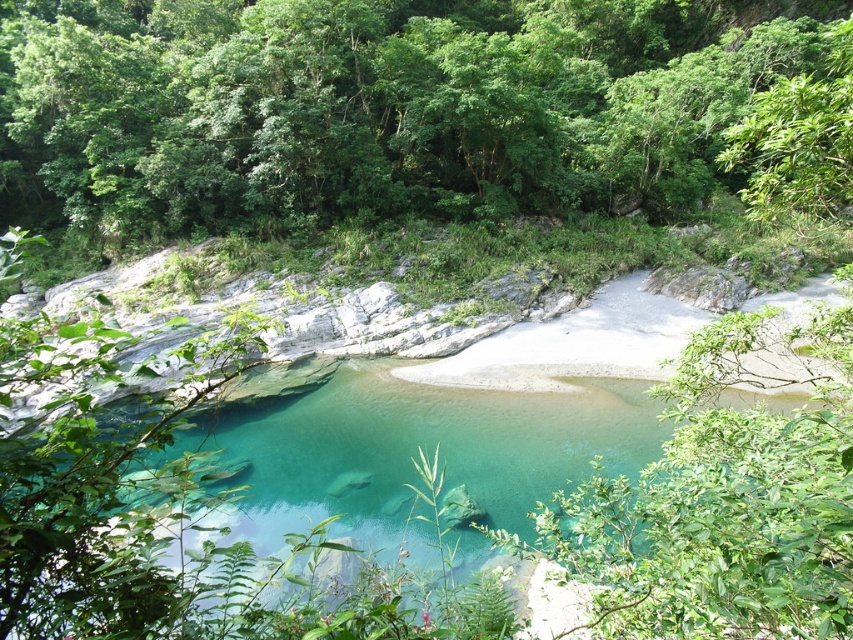
Is point (45, 193) more distant than point (619, 605)?

Yes, point (45, 193) is behind point (619, 605).

You are a GUI agent. You are given a task and a screenshot of the screen. Output one action in this format:
    pyautogui.click(x=<x>, y=<y>)
    Task: Click on the green leafy trees at upper center
    The height and width of the screenshot is (640, 853).
    Given the screenshot: What is the action you would take?
    pyautogui.click(x=375, y=108)

Between point (581, 22) and point (209, 621), which one is positioned in front?

Point (209, 621)

This screenshot has height=640, width=853. In order to click on green leafy trees at upper center in this screenshot , I will do `click(375, 108)`.